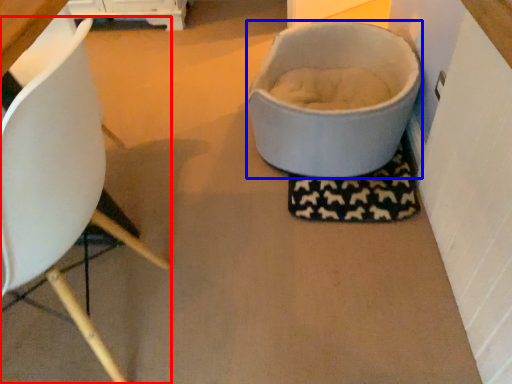
Question: Which object appears closest to the camera in this image, chair (highlighted by a red box) or toilet bowl (highlighted by a blue box)?

Choices:
 (A) chair
 (B) toilet bowl

Answer: (A)